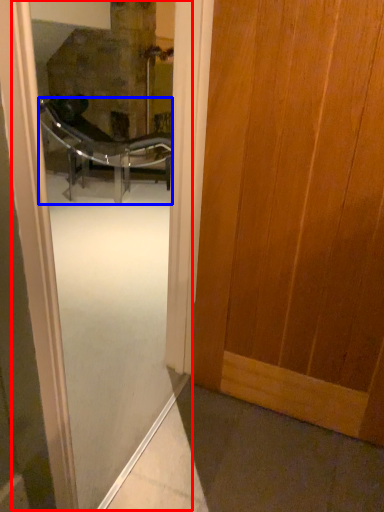
Question: Which point is closer to the camera, screen door (highlighted by a red box) or chair (highlighted by a blue box)?

Choices:
 (A) screen door
 (B) chair

Answer: (A)